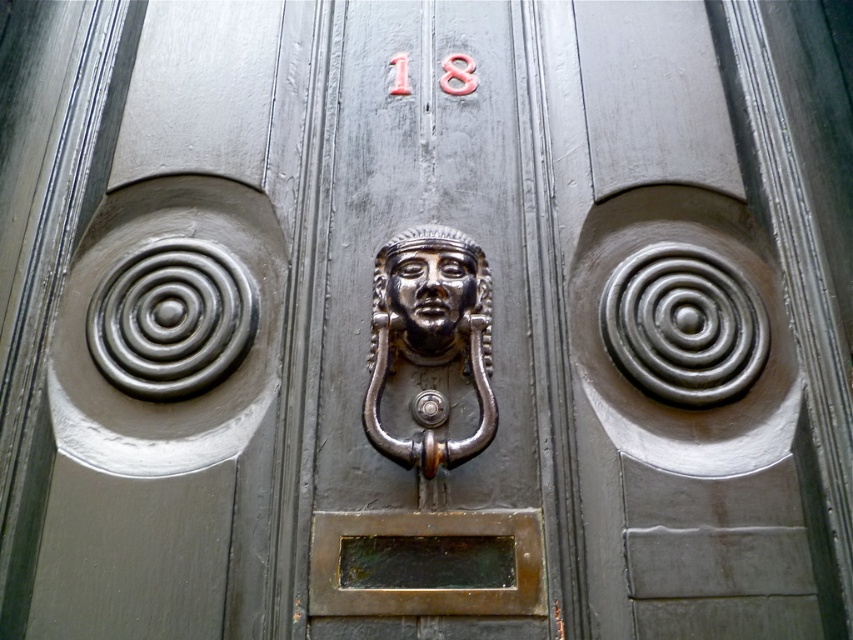
You are a delivery person trying to find the correct apartment number. You see the red painted number at center and the polished silver door knocker at center on the door. Which object should you look at first to determine the apartment number?

The red painted number at center is bigger than the polished silver door knocker at center, so you should look at the red painted number at center first to determine the apartment number.